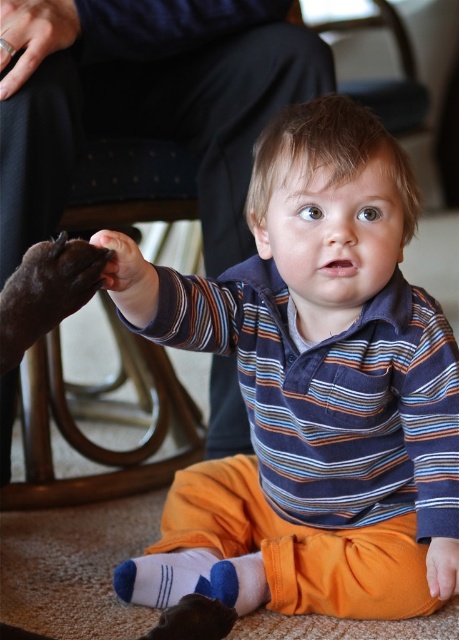
You are a photographer standing in front of the scene. You want to take a photo that includes both the point at (382, 262) and the point at (136, 269). Which point should you focus on to ensure both are in sharp focus?

You should focus on the point at (136, 269) because it is closer to the photographer, and focusing on the closer object will keep both in focus due to the depth of field.

Where is the striped cotton shirt at center located in the image?

The striped cotton shirt at center is located at point (313, 388).

You are a photographer taking a picture of the striped cotton shirt at center and the matte black paw at center. To ensure both are in focus, which object should you adjust your camera to prioritize focusing on first?

The matte black paw at center is behind the striped cotton shirt at center, so you should focus on the matte black paw at center first to ensure both are in focus.